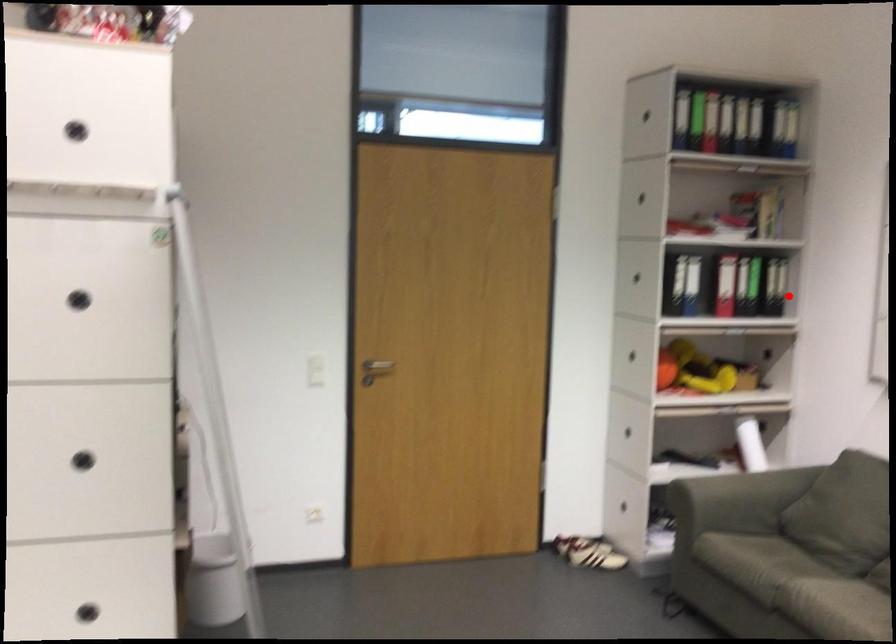
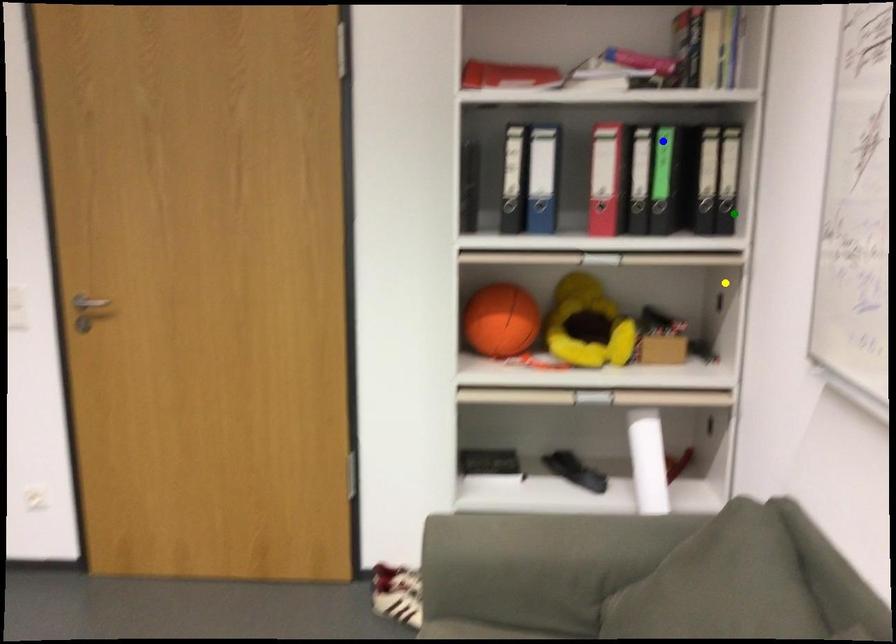
Question: I am providing you with two images of the same scene from different viewpoints. A red point is marked on the first image. You are given multiple points on the second image. Which point in image 2 represents the same 3d spot as the red point in image 1?

Choices:
 (A) green point
 (B) blue point
 (C) yellow point

Answer: (A)